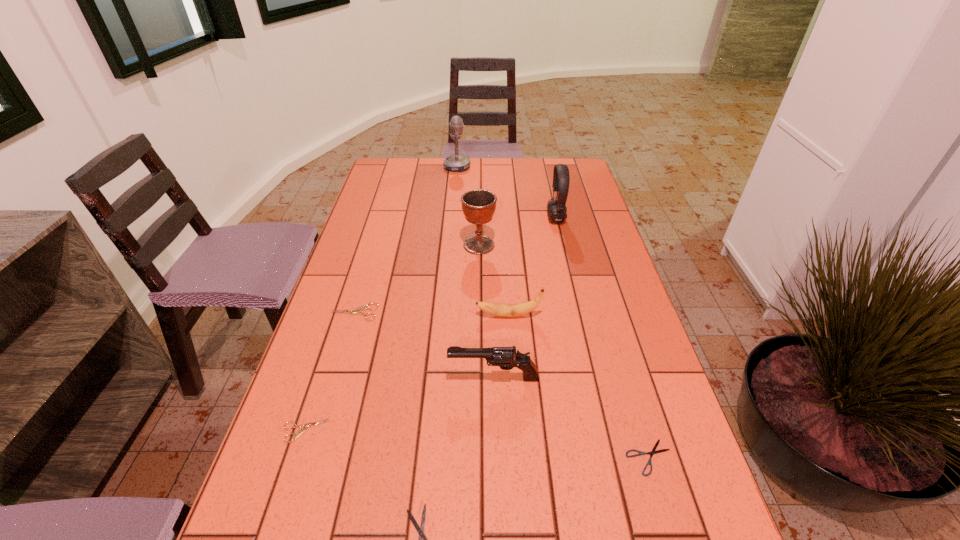
Find the location of `object that ranks as the fifth closest to the smaller beige shears`. object that ranks as the fifth closest to the smaller beige shears is located at coordinates (653, 451).

Where is `object that is the seventh closest to the headset`? This screenshot has width=960, height=540. object that is the seventh closest to the headset is located at coordinates (301, 431).

Find the location of a particular element. the second closest shears to the banana is located at coordinates (653, 451).

Locate which shears ranks fourth in proximity to the gun. Please provide its 2D coordinates. Your answer should be formatted as a tuple, i.e. [(x, y)], where the tuple contains the x and y coordinates of a point satisfying the conditions above.

[(420, 530)]

The height and width of the screenshot is (540, 960). Find the location of `blank space that satisfies the following two spatial constraints: 1. on the front-facing side of the chalice; 2. on the right side of the microphone`. blank space that satisfies the following two spatial constraints: 1. on the front-facing side of the chalice; 2. on the right side of the microphone is located at coordinates (450, 245).

Find the location of a particular element. The width and height of the screenshot is (960, 540). vacant region that satisfies the following two spatial constraints: 1. on the back side of the nearer beige shears; 2. on the left side of the chalice is located at coordinates (366, 245).

I want to click on vacant space that satisfies the following two spatial constraints: 1. on the front side of the farther black shears; 2. on the right side of the nearer beige shears, so click(x=297, y=457).

Where is `free space that satisfies the following two spatial constraints: 1. on the back side of the shortest object; 2. at the end of the barrel of the gun`? free space that satisfies the following two spatial constraints: 1. on the back side of the shortest object; 2. at the end of the barrel of the gun is located at coordinates (626, 378).